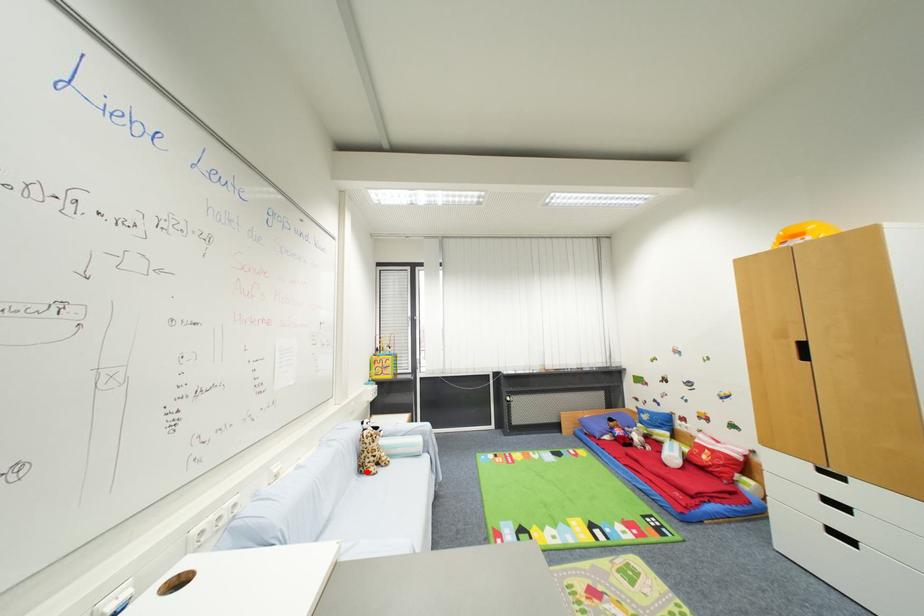
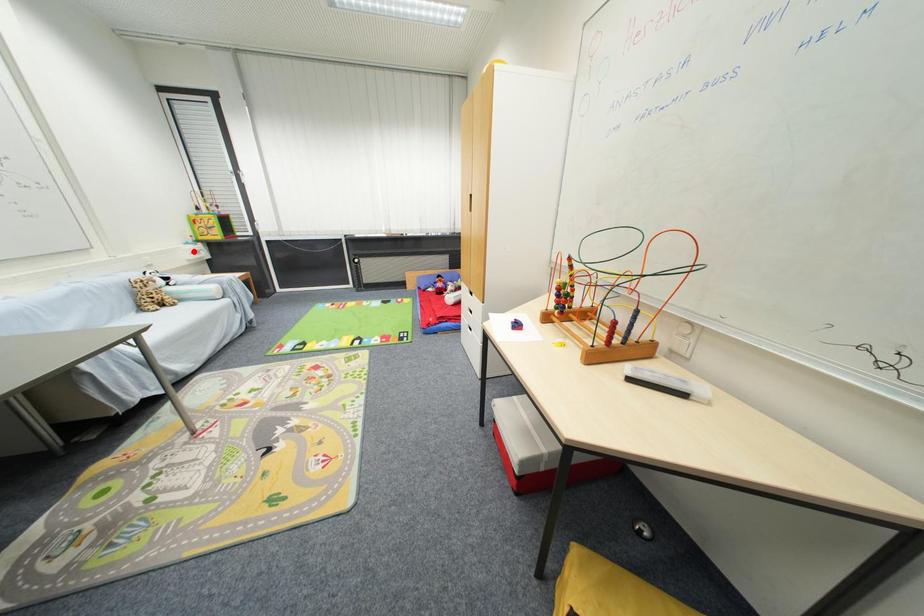
I am providing you with two images of the same scene from different viewpoints. A red point is marked on the first image and another point is marked on the second image. Are the points marked in image1 and image2 representing the same 3D position?

→ No